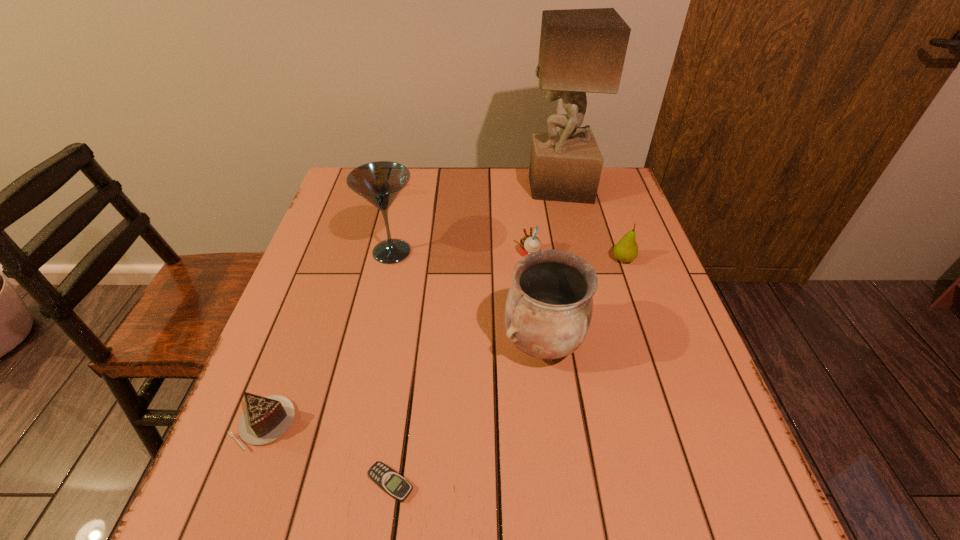
In order to click on blank space at the left edge of the desktop in this screenshot , I will do `click(280, 344)`.

The height and width of the screenshot is (540, 960). In order to click on vacant space at the right edge in this screenshot , I will do `click(643, 233)`.

Where is `blank area at the near left corner`? This screenshot has width=960, height=540. blank area at the near left corner is located at coordinates (297, 484).

The height and width of the screenshot is (540, 960). I want to click on free region at the far right corner, so coord(605,201).

Locate an element on the screen. This screenshot has width=960, height=540. unoccupied position between the urn and the second shortest object is located at coordinates (403, 383).

I want to click on free point between the beeper and the pear, so tap(507, 372).

Where is `free space between the martini and the shortest object`? Image resolution: width=960 pixels, height=540 pixels. free space between the martini and the shortest object is located at coordinates (392, 368).

Identify the location of free spot between the fifth farthest object and the beeper. (467, 413).

You are a GUI agent. You are given a task and a screenshot of the screen. Output one action in this format:
    pyautogui.click(x=<x>, y=<y>)
    Task: Click on the free point between the pear and the leftmost object
    The height and width of the screenshot is (540, 960).
    Given the screenshot: What is the action you would take?
    pyautogui.click(x=444, y=342)

This screenshot has height=540, width=960. I want to click on free spot between the sixth tallest object and the farthest object, so click(x=411, y=305).